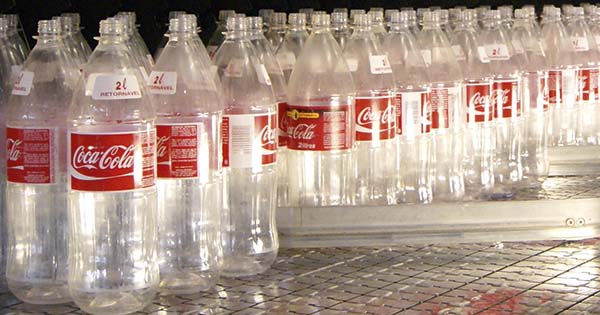
This screenshot has height=315, width=600. Identify the location of the 4th fully visible bottle from the left. (256, 201).